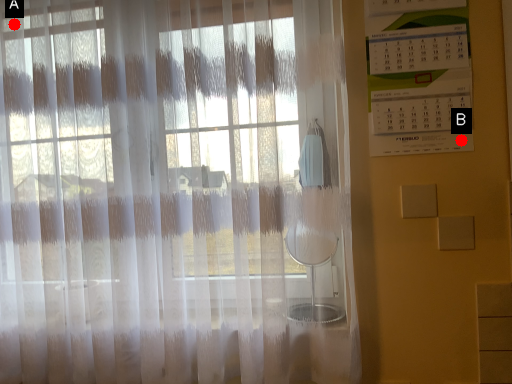
Question: Two points are circled on the image, labeled by A and B beside each circle. Which point is closer to the camera taking this photo?

Choices:
 (A) A is closer
 (B) B is closer

Answer: (B)